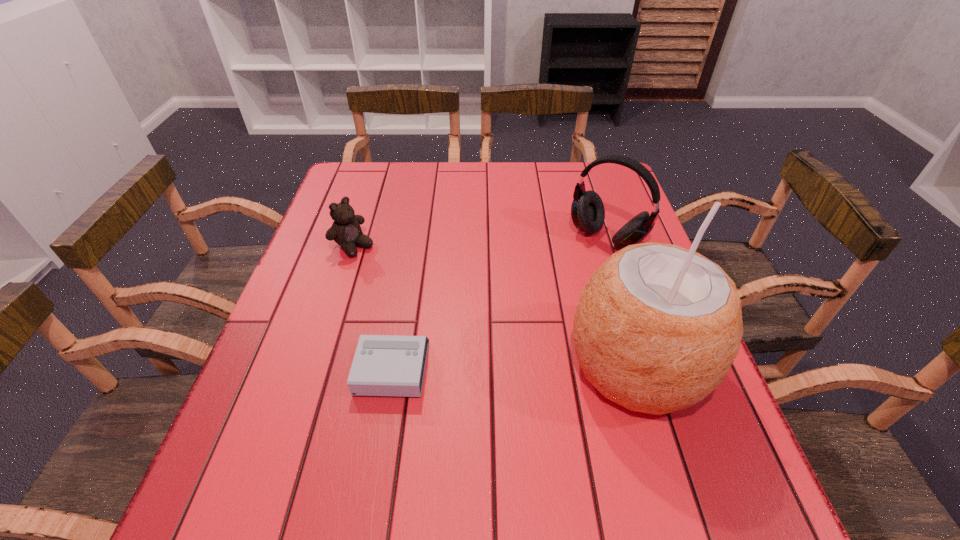
Where is `object that is the nearest to the teddy bear`? The image size is (960, 540). object that is the nearest to the teddy bear is located at coordinates (384, 365).

At what (x,y) coordinates should I click in order to perform the action: click on object that stands as the closest to the headset. Please return your answer as a coordinate pair (x, y). The width and height of the screenshot is (960, 540). Looking at the image, I should click on (657, 327).

Locate an element on the screen. blank area in the image that satisfies the following two spatial constraints: 1. on the back side of the second tallest object; 2. on the right side of the shortest object is located at coordinates (415, 237).